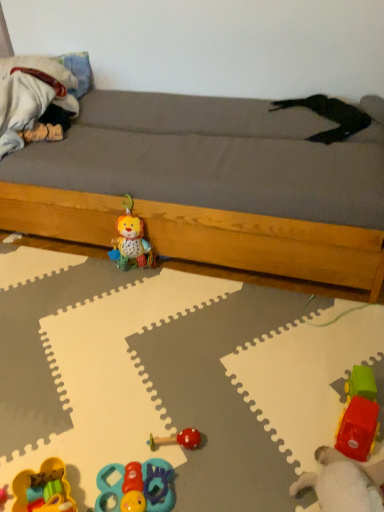
The height and width of the screenshot is (512, 384). I want to click on vacant point to the right of smooth plastic rattle at center, acting as the fourth toy starting from the left, so click(x=239, y=437).